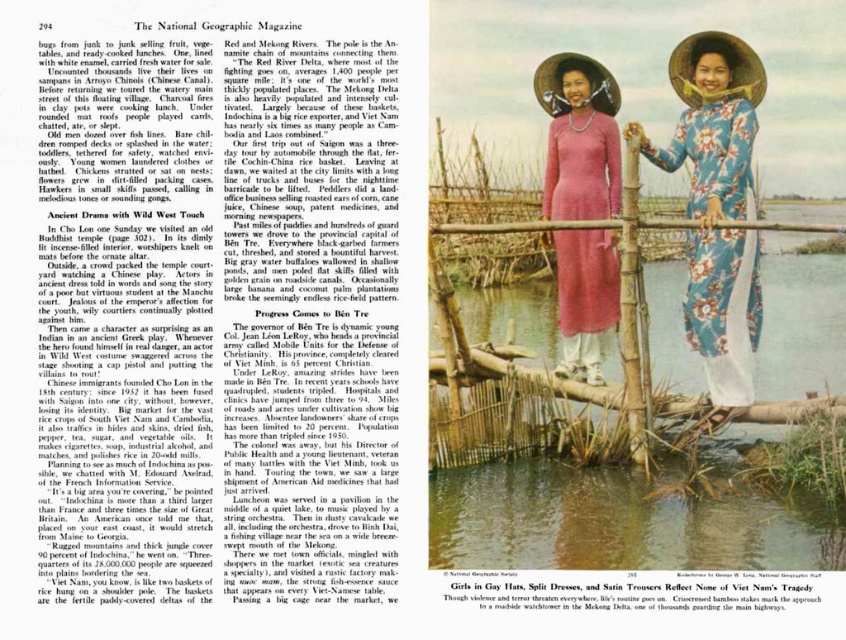
Is point (707, 134) positioned after point (545, 182)?

No, it is in front of (545, 182).

Based on the photo, does floral silk ao dai at center have a greater width compared to pink silk dress at center?

No, floral silk ao dai at center is not wider than pink silk dress at center.

Which is in front, point (722, 252) or point (564, 268)?

Point (722, 252)

In order to click on floral silk ao dai at center in this screenshot , I will do `click(717, 208)`.